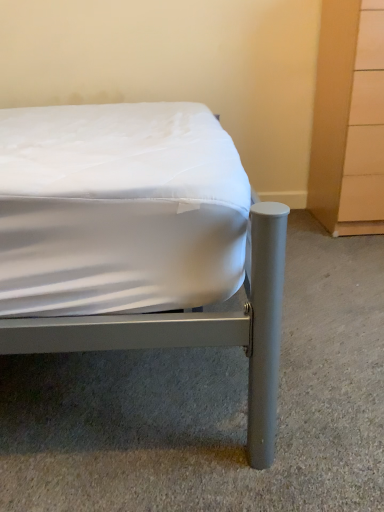
Question: From their relative heights in the image, would you say metallic gray bed at center is taller or shorter than light wood dresser at right?

Choices:
 (A) tall
 (B) short

Answer: (B)

Question: Is metallic gray bed at center wider or thinner than light wood dresser at right?

Choices:
 (A) thin
 (B) wide

Answer: (B)

Question: In the image, is metallic gray bed at center on the left side or the right side of light wood dresser at right?

Choices:
 (A) left
 (B) right

Answer: (A)

Question: In terms of width, does light wood dresser at right look wider or thinner when compared to metallic gray bed at center?

Choices:
 (A) wide
 (B) thin

Answer: (B)

Question: From their relative heights in the image, would you say light wood dresser at right is taller or shorter than metallic gray bed at center?

Choices:
 (A) short
 (B) tall

Answer: (B)

Question: Considering their positions, is light wood dresser at right located in front of or behind metallic gray bed at center?

Choices:
 (A) front
 (B) behind

Answer: (B)

Question: From a real-world perspective, is light wood dresser at right above or below metallic gray bed at center?

Choices:
 (A) above
 (B) below

Answer: (B)